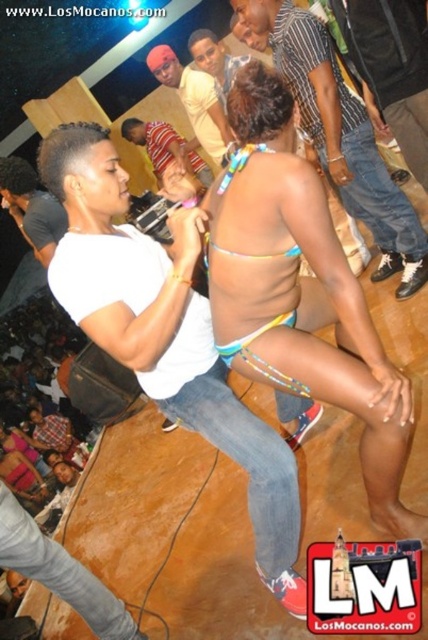
Question: Does multicolored string bikini at center appear on the right side of matte yellow shirt at upper center?

Choices:
 (A) no
 (B) yes

Answer: (B)

Question: Which point is closer to the camera?

Choices:
 (A) striped shirt at upper center
 (B) multicolored string bikini at center

Answer: (B)

Question: Estimate the real-world distances between objects in this image. Which object is farther from the multicolored fabric bikini top at center?

Choices:
 (A) matte yellow shirt at upper center
 (B) multicolored string bikini at center

Answer: (A)

Question: Considering the relative positions of multicolored fabric bikini top at center and multicolored string bikini at center in the image provided, where is multicolored fabric bikini top at center located with respect to multicolored string bikini at center?

Choices:
 (A) below
 (B) above

Answer: (B)

Question: Which point is closer to the camera?

Choices:
 (A) (252, 8)
 (B) (281, 497)
 (C) (214, 104)
 (D) (357, 305)

Answer: (D)

Question: Is multicolored fabric bikini top at center to the left of striped shirt at upper center from the viewer's perspective?

Choices:
 (A) yes
 (B) no

Answer: (A)